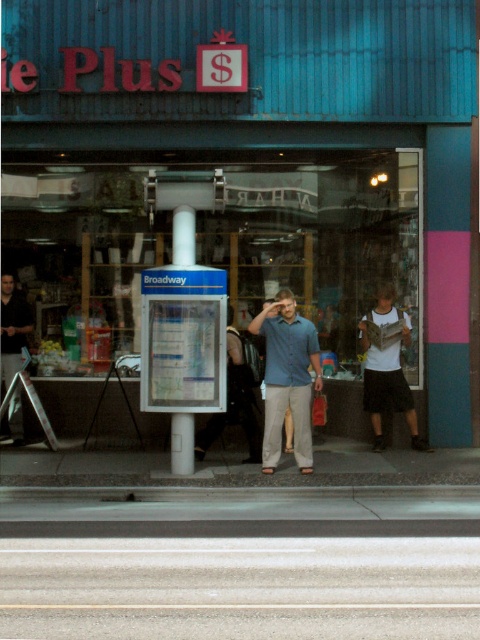
Does point (101, 200) come in front of point (265, 324)?

No, it is behind (265, 324).

Describe the element at coordinates (212, 248) in the screenshot. I see `transparent glass shop window at center` at that location.

I want to click on transparent glass shop window at center, so click(x=212, y=248).

Does point (312, 365) come behind point (398, 358)?

That is False.

From the picture: Is blue cotton shirt at center wider than white cotton t-shirt at center?

In fact, blue cotton shirt at center might be narrower than white cotton t-shirt at center.

Where is `blue cotton shirt at center`? The height and width of the screenshot is (640, 480). blue cotton shirt at center is located at coordinates (288, 378).

This screenshot has width=480, height=640. In order to click on blue cotton shirt at center in this screenshot , I will do `click(288, 378)`.

Is transparent glass shop window at center above white cotton t-shirt at center?

Yes, transparent glass shop window at center is above white cotton t-shirt at center.

Does transparent glass shop window at center have a lesser width compared to white cotton t-shirt at center?

Indeed, transparent glass shop window at center has a lesser width compared to white cotton t-shirt at center.

Measure the distance between transparent glass shop window at center and camera.

49.60 feet

Where is `transparent glass shop window at center`? This screenshot has width=480, height=640. transparent glass shop window at center is located at coordinates (212, 248).